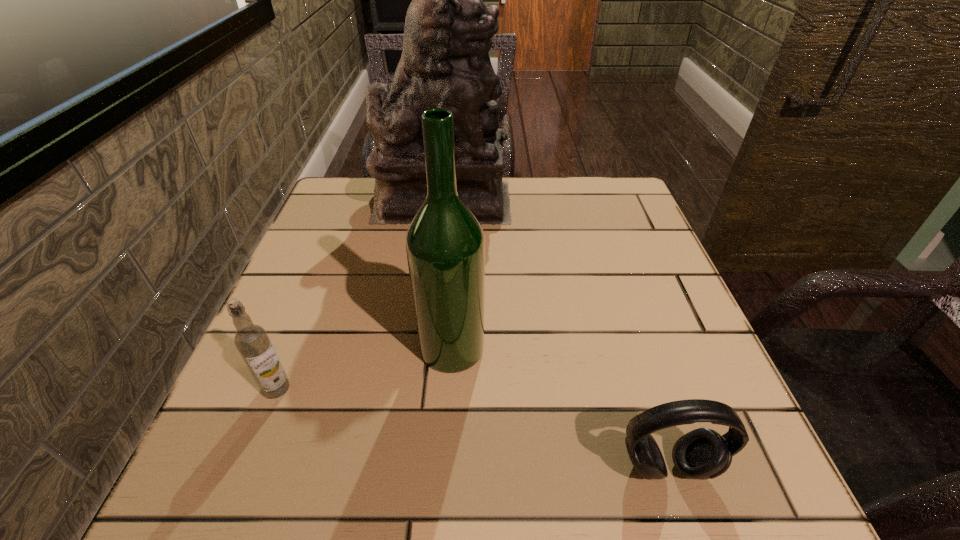
At what (x,y) coordinates should I click in order to perform the action: click on free space at the far left corner. Please return your answer as a coordinate pair (x, y). Looking at the image, I should click on (373, 194).

In the image, there is a desktop. Identify the location of vacant space at the near left corner. (231, 505).

Where is `vacant space at the far right corner of the desktop`? vacant space at the far right corner of the desktop is located at coordinates [636, 200].

Identify the location of free space at the near right corner. (701, 498).

Identify the location of vacant region between the second shortest object and the alcohol. This screenshot has height=540, width=960. (364, 368).

Find the location of `vacant region between the rightmost object and the sculpture`. vacant region between the rightmost object and the sculpture is located at coordinates (555, 334).

This screenshot has width=960, height=540. Identify the location of vacant space that is in between the third tallest object and the shortest object. (472, 428).

At what (x,y) coordinates should I click in order to perform the action: click on free space between the rightmost object and the sculpture. Please return your answer as a coordinate pair (x, y). Looking at the image, I should click on (555, 334).

This screenshot has height=540, width=960. I want to click on empty space that is in between the headset and the second farthest object, so click(x=560, y=407).

Where is `free point between the farthest object and the leftmost object`? Image resolution: width=960 pixels, height=540 pixels. free point between the farthest object and the leftmost object is located at coordinates (360, 294).